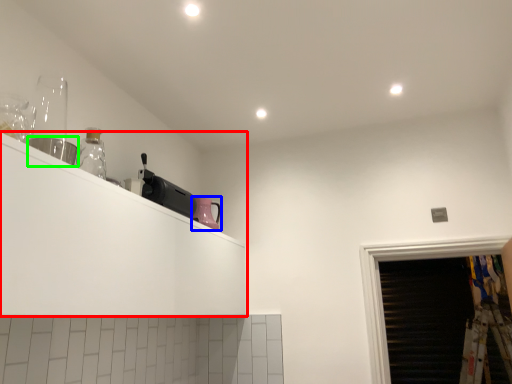
Question: Which object is positioned farthest from shelf (highlighted by a red box)? Select from appliance (highlighted by a blue box) and appliance (highlighted by a green box).

Choices:
 (A) appliance
 (B) appliance

Answer: (A)